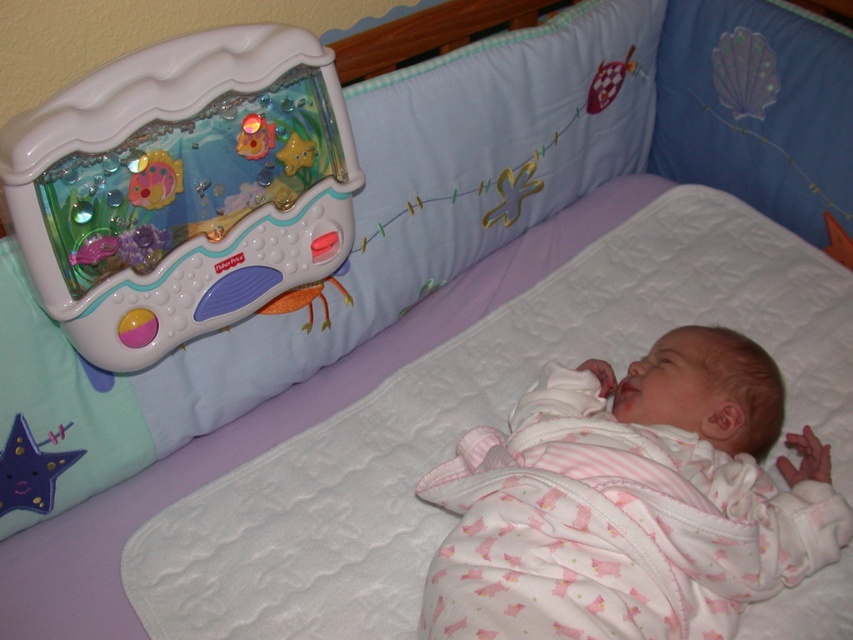
Is point (287, 28) in front of point (61, 394)?

Yes, it is in front of point (61, 394).

The width and height of the screenshot is (853, 640). What are the coordinates of `plastic toy at upper left` in the screenshot? It's located at (183, 189).

Does pink cotton baby at center have a larger size compared to purple fabric star at lower left?

Yes.

Does point (601, 513) lie behind point (6, 504)?

No, it is in front of (6, 504).

Which is behind, point (619, 474) or point (39, 486)?

The point (39, 486) is more distant.

The height and width of the screenshot is (640, 853). I want to click on pink cotton baby at center, so click(630, 502).

Which is more to the left, purple fabric star at lower left or matte plastic fish at upper left?

Positioned to the left is purple fabric star at lower left.

Between purple fabric star at lower left and matte plastic fish at upper left, which one has more height?

purple fabric star at lower left

Which is behind, point (24, 435) or point (155, 164)?

The point (24, 435) is more distant.

This screenshot has width=853, height=640. Identify the location of purple fabric star at lower left. (28, 470).